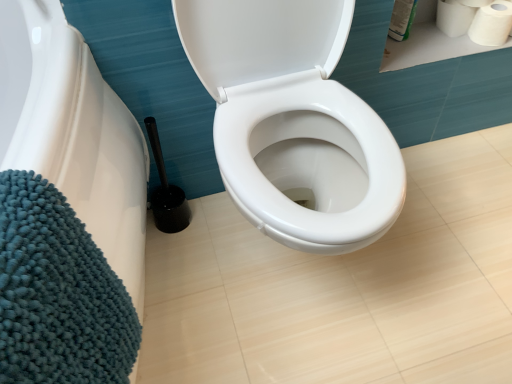
The height and width of the screenshot is (384, 512). What are the coordinates of `vacant space to the left of white matte toilet paper at upper right, marked as the 2th toilet paper in a right-to-left arrangement` in the screenshot? It's located at (415, 35).